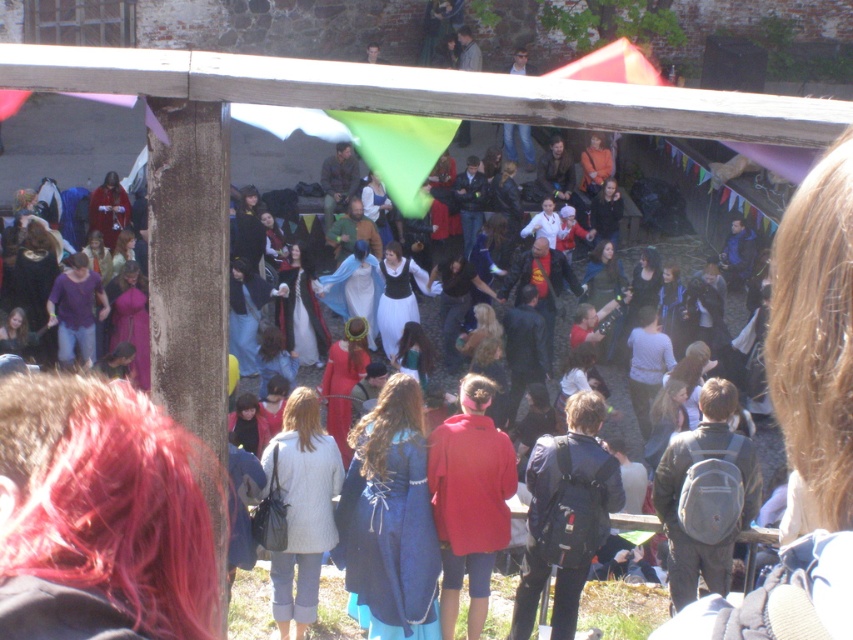
Question: Among these points, which one is nearest to the camera?

Choices:
 (A) (573, 492)
 (B) (473, 432)

Answer: (A)

Question: Observing the image, what is the correct spatial positioning of matte red hoodie at center in reference to dark blue fabric coat at center?

Choices:
 (A) right
 (B) left

Answer: (B)

Question: Considering the relative positions of matte red hoodie at center and dark blue fabric coat at center in the image provided, where is matte red hoodie at center located with respect to dark blue fabric coat at center?

Choices:
 (A) below
 (B) above

Answer: (B)

Question: From the image, what is the correct spatial relationship of matte red hoodie at center in relation to dark blue fabric coat at center?

Choices:
 (A) left
 (B) right

Answer: (A)